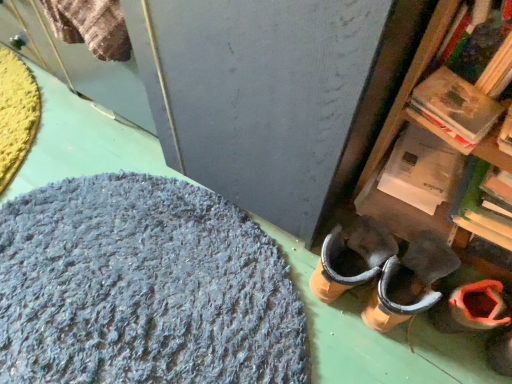
Question: Is shaggy gray rug at lower left to the left or to the right of orange suede boot at lower right in the image?

Choices:
 (A) right
 (B) left

Answer: (B)

Question: Considering the positions of shaggy gray rug at lower left and orange suede boot at lower right in the image, is shaggy gray rug at lower left taller or shorter than orange suede boot at lower right?

Choices:
 (A) tall
 (B) short

Answer: (B)

Question: Looking at their shapes, would you say shaggy gray rug at lower left is wider or thinner than orange suede boot at lower right?

Choices:
 (A) thin
 (B) wide

Answer: (B)

Question: In terms of width, does orange suede boot at lower right look wider or thinner when compared to shaggy gray rug at lower left?

Choices:
 (A) wide
 (B) thin

Answer: (B)

Question: Is orange suede boot at lower right inside the boundaries of shaggy gray rug at lower left, or outside?

Choices:
 (A) inside
 (B) outside

Answer: (B)

Question: From a real-world perspective, is orange suede boot at lower right above or below shaggy gray rug at lower left?

Choices:
 (A) above
 (B) below

Answer: (A)

Question: From the image's perspective, is orange suede boot at lower right positioned above or below shaggy gray rug at lower left?

Choices:
 (A) above
 (B) below

Answer: (B)